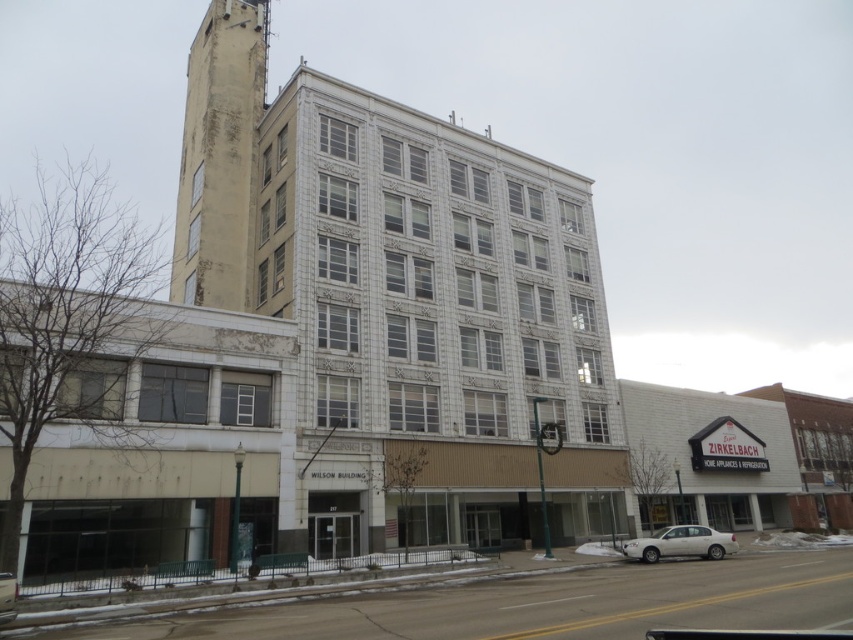
Question: Estimate the real-world distances between objects in this image. Which object is farther from the silver metallic sedan at lower left?

Choices:
 (A) yellowish concrete bell tower at upper left
 (B) white matte sedan at lower center

Answer: (A)

Question: Which of the following is the farthest from the observer?

Choices:
 (A) coord(4,608)
 (B) coord(712,541)

Answer: (B)

Question: Is yellowish concrete bell tower at upper left smaller than silver metallic sedan at lower left?

Choices:
 (A) no
 (B) yes

Answer: (A)

Question: Is the position of white matte sedan at lower center more distant than that of silver metallic sedan at lower left?

Choices:
 (A) yes
 (B) no

Answer: (A)

Question: Which of the following is the farthest from the observer?

Choices:
 (A) yellowish concrete bell tower at upper left
 (B) silver metallic sedan at lower left
 (C) white matte sedan at lower center

Answer: (A)

Question: Does yellowish concrete bell tower at upper left have a greater width compared to silver metallic sedan at lower left?

Choices:
 (A) no
 (B) yes

Answer: (B)